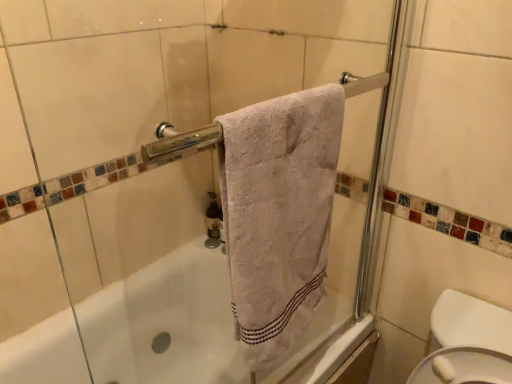
Question: Is white textured towel at center smaller than matte brown soap dispenser at center?

Choices:
 (A) no
 (B) yes

Answer: (A)

Question: Is white textured towel at center directly adjacent to matte brown soap dispenser at center?

Choices:
 (A) no
 (B) yes

Answer: (A)

Question: Would you say white textured towel at center is outside matte brown soap dispenser at center?

Choices:
 (A) no
 (B) yes

Answer: (B)

Question: Is white textured towel at center not near matte brown soap dispenser at center?

Choices:
 (A) yes
 (B) no

Answer: (B)

Question: From the image's perspective, is white textured towel at center located beneath matte brown soap dispenser at center?

Choices:
 (A) yes
 (B) no

Answer: (B)

Question: From the image's perspective, is white textured towel at center located above matte brown soap dispenser at center?

Choices:
 (A) no
 (B) yes

Answer: (B)

Question: Is white textured towel at center inside matte brown soap dispenser at center?

Choices:
 (A) yes
 (B) no

Answer: (B)

Question: Is matte brown soap dispenser at center facing towards white textured towel at center?

Choices:
 (A) no
 (B) yes

Answer: (A)

Question: Can you confirm if matte brown soap dispenser at center is taller than white textured towel at center?

Choices:
 (A) yes
 (B) no

Answer: (B)

Question: Can you confirm if matte brown soap dispenser at center is positioned to the right of white textured towel at center?

Choices:
 (A) no
 (B) yes

Answer: (A)

Question: From a real-world perspective, is matte brown soap dispenser at center positioned over white textured towel at center based on gravity?

Choices:
 (A) yes
 (B) no

Answer: (B)

Question: Considering the relative sizes of matte brown soap dispenser at center and white textured towel at center in the image provided, is matte brown soap dispenser at center shorter than white textured towel at center?

Choices:
 (A) no
 (B) yes

Answer: (B)

Question: Is point (270, 261) closer or farther from the camera than point (212, 195)?

Choices:
 (A) closer
 (B) farther

Answer: (A)